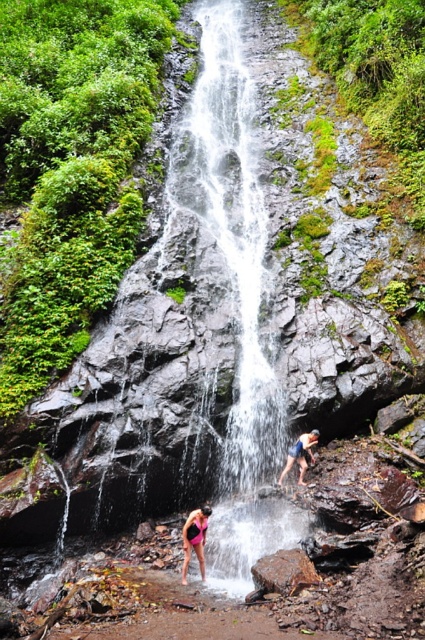
You are standing at the edge of the waterfall and see a brown rough rock at center and a pink matte swimsuit at lower center. Which object is shorter in height?

The brown rough rock at center has a lesser height compared to the pink matte swimsuit at lower center, so the brown rough rock at center is shorter.

You are standing at the edge of the waterfall and want to place a small statue on the brown rough rock at center. Given that the coordinates of the rock are at point 0.894, 0.671, can you confirm if this rock is positioned centrally within the image?

The brown rough rock at center is located at point (285,572), which indicates it is positioned centrally within the image based on the coordinate system provided.

Consider the image. You are a hiker who wants to cross the waterfall area. You have a 3 meter long rope. You see the white textured water at center and the brown rough rock at center. Can you use the rope to bridge the gap between them?

The gap between the white textured water at center and the brown rough rock at center is 2.85 meters. Since the rope is 3 meters long, it is long enough to bridge the gap between them. You can use the rope to cross safely.